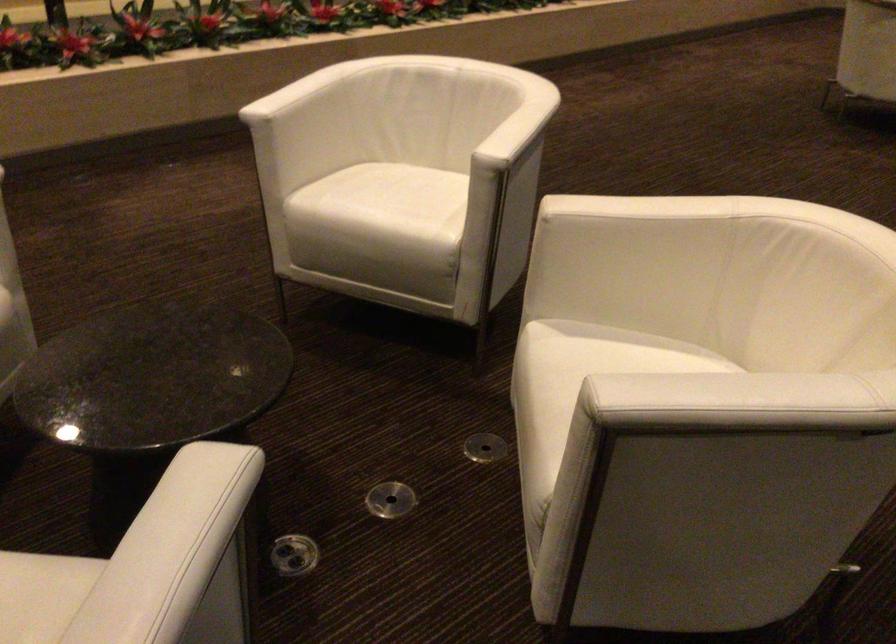
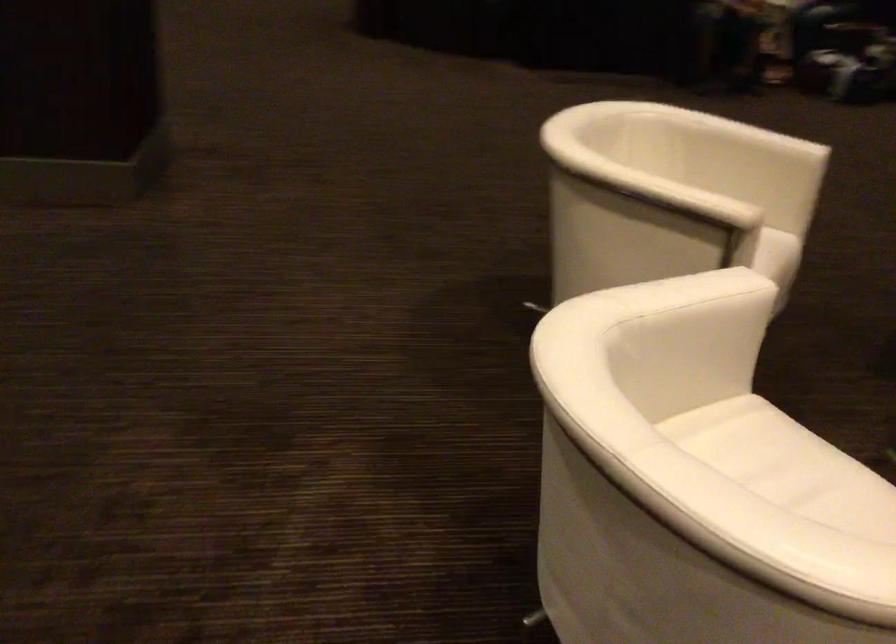
The point at [426,196] is marked in the first image. Where is the corresponding point in the second image?

(767, 453)